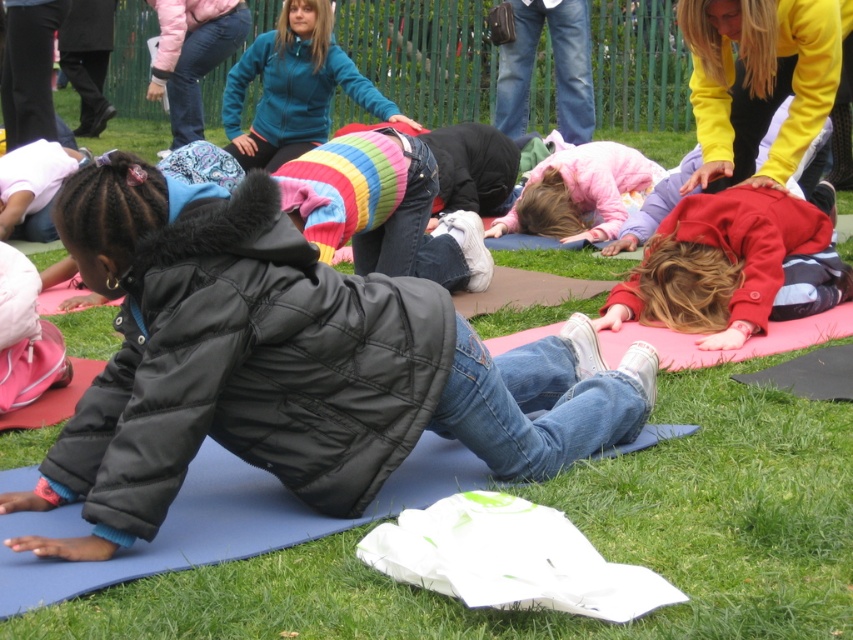
Question: From the image, what is the correct spatial relationship of black quilted jacket at center in relation to striped sweater at center?

Choices:
 (A) below
 (B) above

Answer: (A)

Question: Which object is the closest to the striped sweater at center?

Choices:
 (A) red matte jacket at lower right
 (B) matte black jacket at lower left

Answer: (A)

Question: Among these points, which one is nearest to the camera?

Choices:
 (A) (654, 310)
 (B) (21, 330)

Answer: (B)

Question: Among these objects, which one is nearest to the camera?

Choices:
 (A) black quilted jacket at center
 (B) matte black jacket at lower left
 (C) red matte jacket at lower right
 (D) striped sweater at center

Answer: (A)

Question: Is striped sweater at center above pink fleece jacket at center?

Choices:
 (A) no
 (B) yes

Answer: (B)

Question: Is red matte jacket at lower right thinner than pink fleece jacket at center?

Choices:
 (A) no
 (B) yes

Answer: (A)